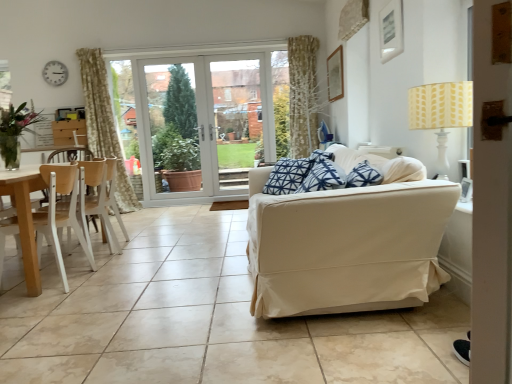
Where is `vacant space that is in between beige fabric couch at right and light wood/wooden chair at left, which appears as the second chair when viewed from the back`? The width and height of the screenshot is (512, 384). vacant space that is in between beige fabric couch at right and light wood/wooden chair at left, which appears as the second chair when viewed from the back is located at coordinates (167, 276).